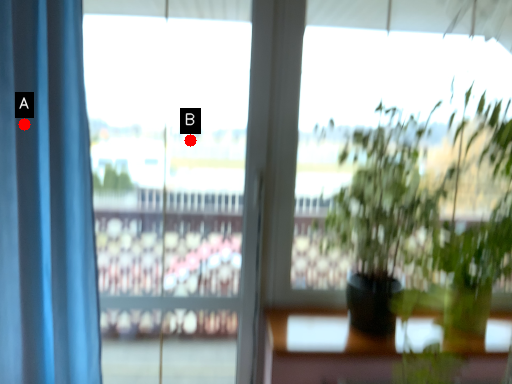
Question: Two points are circled on the image, labeled by A and B beside each circle. Which point is further to the camera?

Choices:
 (A) A is further
 (B) B is further

Answer: (B)